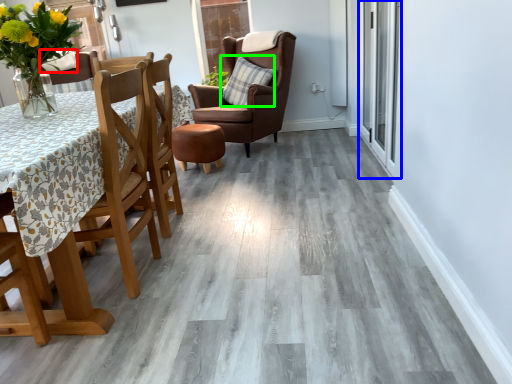
Question: Which object is positioned farthest from pillow (highlighted by a red box)? Select from glass door (highlighted by a blue box) and pillow (highlighted by a green box).

Choices:
 (A) glass door
 (B) pillow

Answer: (A)